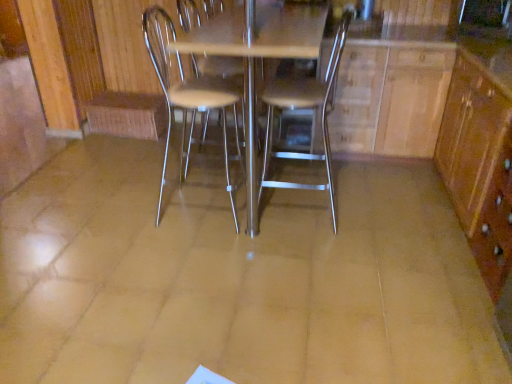
Question: From their relative heights in the image, would you say brown wood/file cabinet at right is taller or shorter than metallic silver table at center?

Choices:
 (A) short
 (B) tall

Answer: (A)

Question: In terms of width, does brown wood/file cabinet at right look wider or thinner when compared to metallic silver table at center?

Choices:
 (A) wide
 (B) thin

Answer: (B)

Question: Which is farther from the wooden dresser at center?

Choices:
 (A) metallic silver chair at center, the first chair when ordered from left to right
 (B) brown wood/file cabinet at right
 (C) metallic silver chair at center, placed as the second chair when sorted from left to right
 (D) metallic silver table at center

Answer: (A)

Question: Which is farther from the metallic silver table at center?

Choices:
 (A) metallic silver chair at center, the first chair when ordered from left to right
 (B) wooden dresser at center
 (C) brown wood/file cabinet at right
 (D) metallic silver chair at center, placed as the second chair when sorted from left to right

Answer: (C)